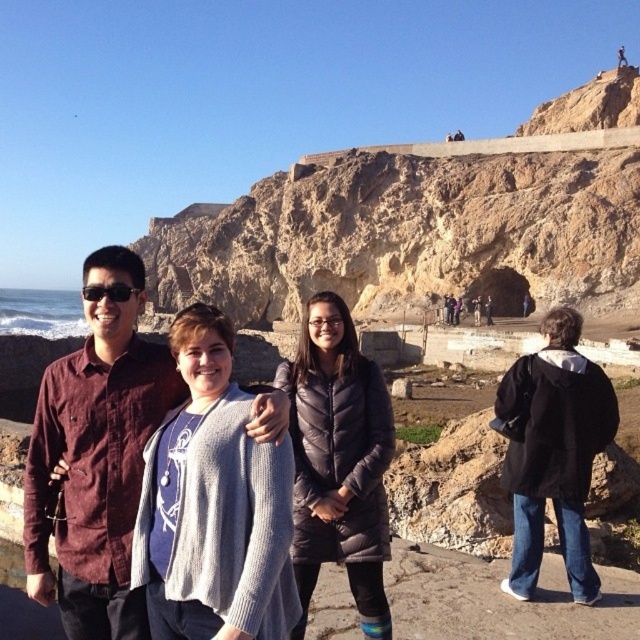
Question: Which point is farther to the camera?

Choices:
 (A) black matte jacket at lower right
 (B) black puffer jacket at center

Answer: (A)

Question: Does rustic stone cliff at upper center have a larger size compared to black matte jacket at lower right?

Choices:
 (A) yes
 (B) no

Answer: (A)

Question: Among these points, which one is nearest to the camera?

Choices:
 (A) (164, 246)
 (B) (576, 506)

Answer: (B)

Question: Can you confirm if rustic stone cliff at upper center is bigger than gray knit sweater at center?

Choices:
 (A) no
 (B) yes

Answer: (B)

Question: From the image, what is the correct spatial relationship of gray knit sweater at center in relation to black matte jacket at lower right?

Choices:
 (A) above
 (B) below

Answer: (A)

Question: Which point appears closest to the camera in this image?

Choices:
 (A) (308, 424)
 (B) (364, 156)

Answer: (A)